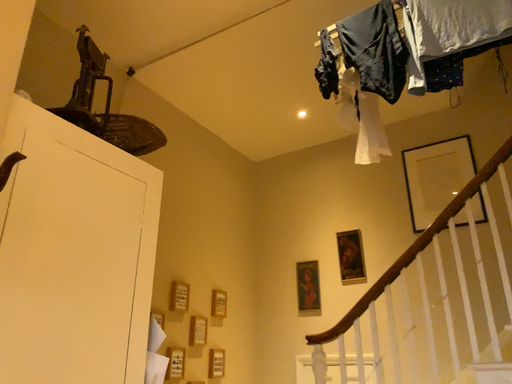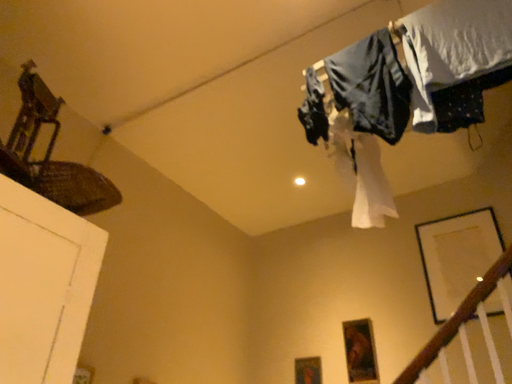
Question: How did the camera likely rotate when shooting the video?

Choices:
 (A) rotated downward
 (B) rotated upward

Answer: (B)